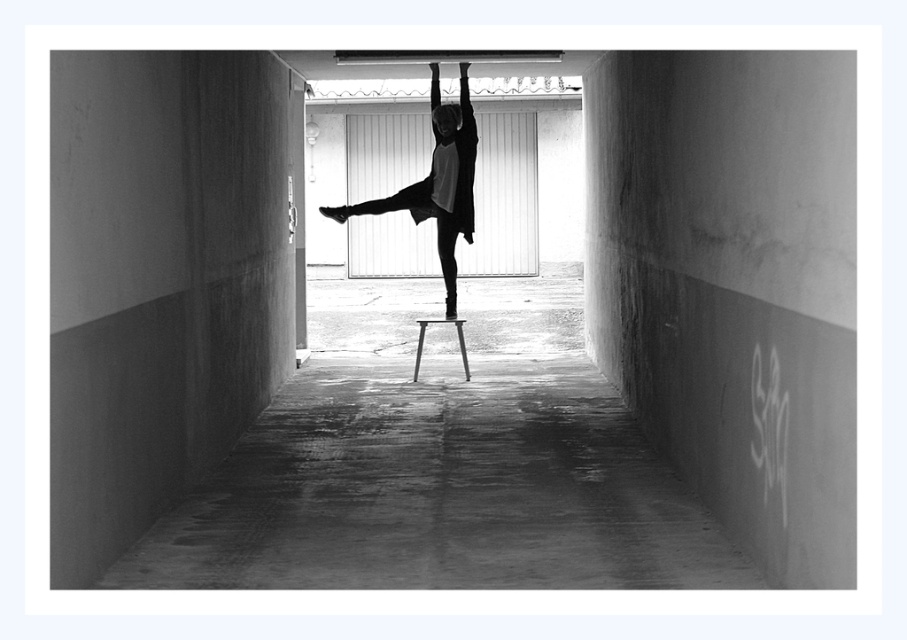
Question: Is concrete floor at center smaller than metallic silver stool at center?

Choices:
 (A) no
 (B) yes

Answer: (A)

Question: Among these objects, which one is nearest to the camera?

Choices:
 (A) concrete floor at center
 (B) metallic silver stool at center

Answer: (A)

Question: Does matte black dress at center have a greater width compared to metallic silver stool at center?

Choices:
 (A) yes
 (B) no

Answer: (A)

Question: Which point is closer to the camera?

Choices:
 (A) (98, 424)
 (B) (418, 324)

Answer: (A)

Question: Is concrete floor at center below matte black dress at center?

Choices:
 (A) yes
 (B) no

Answer: (A)

Question: Which is farther from the matte black dress at center?

Choices:
 (A) metallic silver stool at center
 (B) concrete floor at center

Answer: (B)